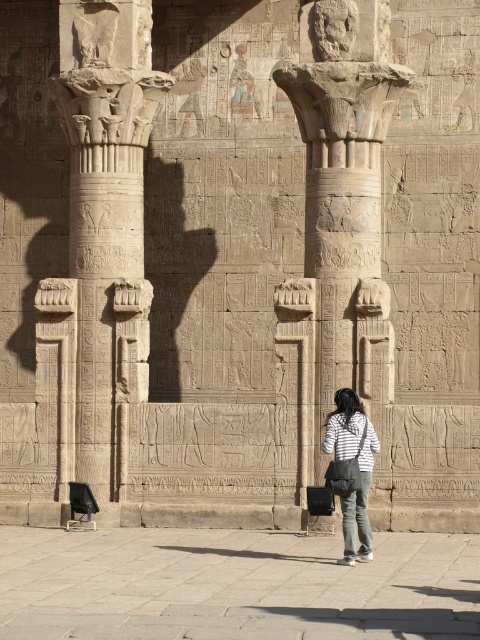
Question: Which of the following is the farthest from the observer?

Choices:
 (A) (359, 145)
 (B) (352, 516)
 (C) (119, 436)

Answer: (C)

Question: Which point appears closest to the camera in this image?

Choices:
 (A) (338, 8)
 (B) (119, 220)
 (C) (349, 497)
 (D) (369, 477)

Answer: (C)

Question: Is carved stone column at center below denim jeans at center?

Choices:
 (A) no
 (B) yes

Answer: (A)

Question: Observing the image, what is the correct spatial positioning of carved stone column at left in reference to denim jeans at center?

Choices:
 (A) right
 (B) left

Answer: (B)

Question: Which is farther from the carved stone column at center?

Choices:
 (A) denim jeans at center
 (B) white striped shirt at center

Answer: (A)

Question: Does carved stone column at left appear on the left side of white striped shirt at center?

Choices:
 (A) no
 (B) yes

Answer: (B)